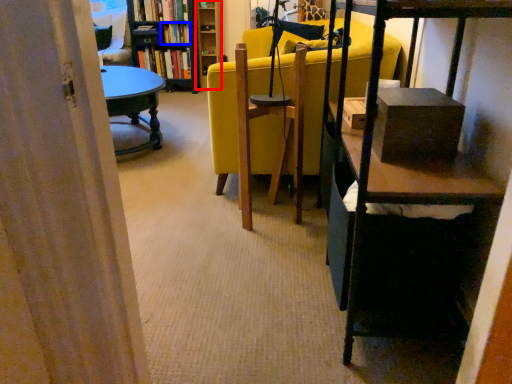
Question: Which point is further to the camera, shelf (highlighted by a red box) or book (highlighted by a blue box)?

Choices:
 (A) shelf
 (B) book

Answer: (B)